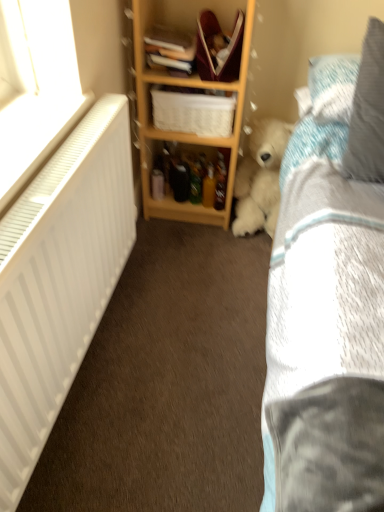
You are a GUI agent. You are given a task and a screenshot of the screen. Output one action in this format:
    pyautogui.click(x=<x>, y=<y>)
    Task: Click on the empty space that is ontop of hardcover book at upper center, marked as the second book in a top-to-bottom arrangement (from a real-world perspective)
    
    Given the screenshot: What is the action you would take?
    pyautogui.click(x=170, y=47)